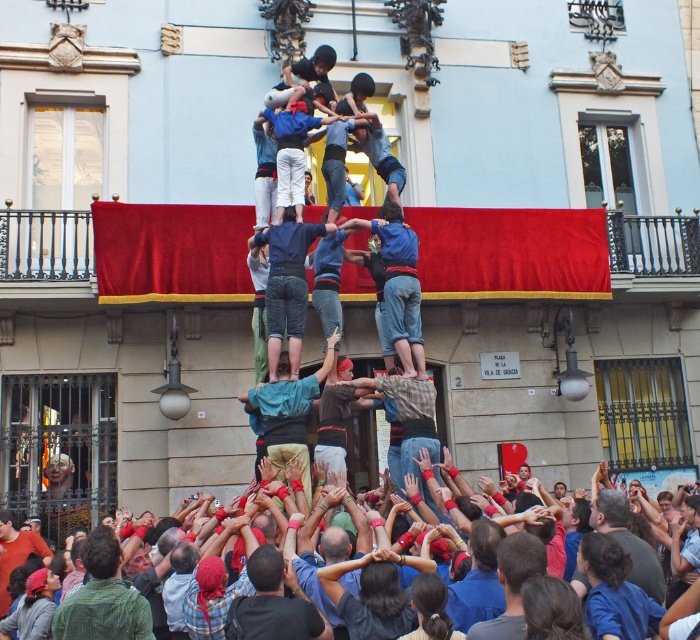
You are a photographer trying to capture the human tower in the scene. You notice the blue denim jeans at center and the plaid shirt at center in your frame. Which clothing item takes up more area in the photo?

The plaid shirt at center takes up more area in the photo because it occupies more space than the blue denim jeans at center.

You are standing in front of the castell and want to take a photo of the blue denim jeans at center and the plaid shirt at center. Which one will appear larger in your photo?

The blue denim jeans at center will appear larger in the photo because it is closer to the viewer than the plaid shirt at center.